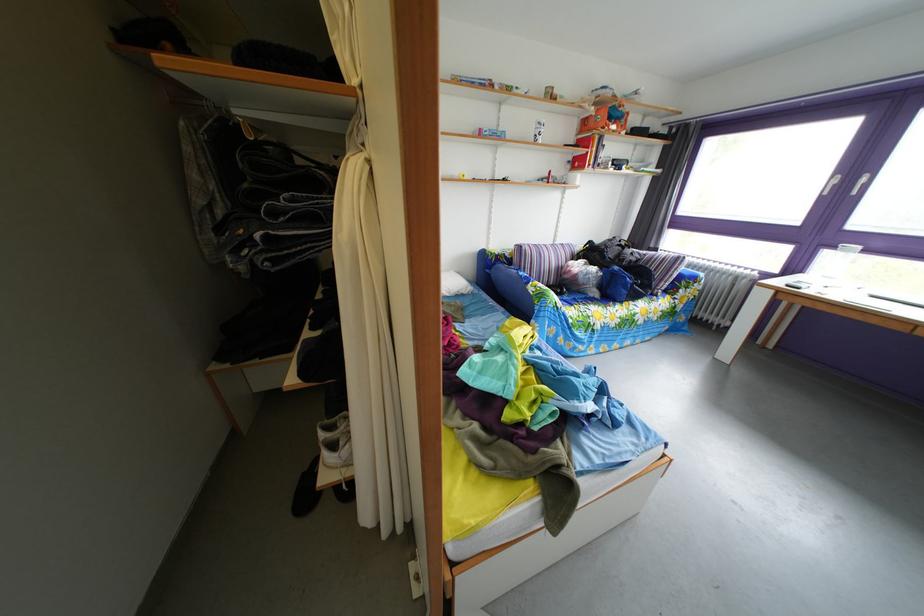
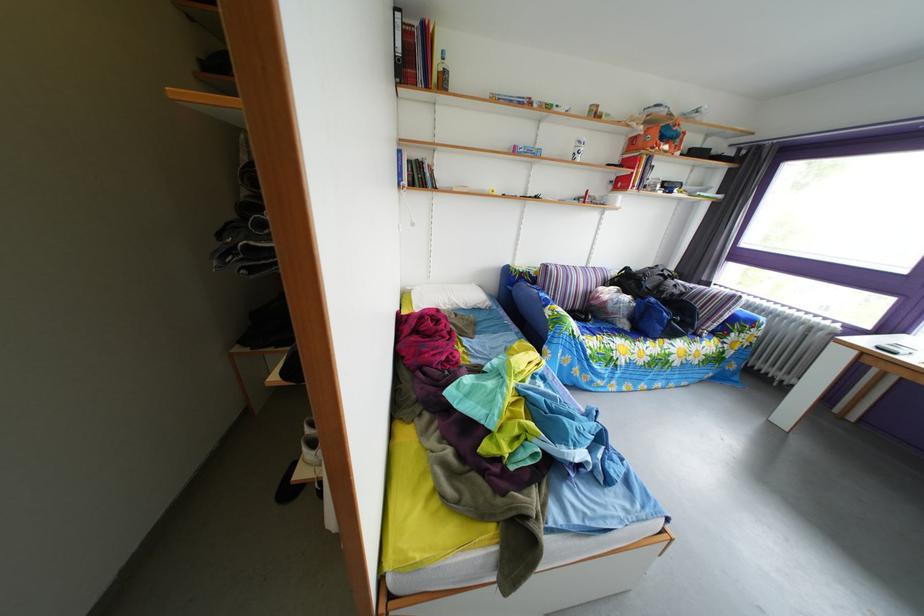
Find the pixel in the second image that matches pixel 565 249 in the first image.

(599, 270)